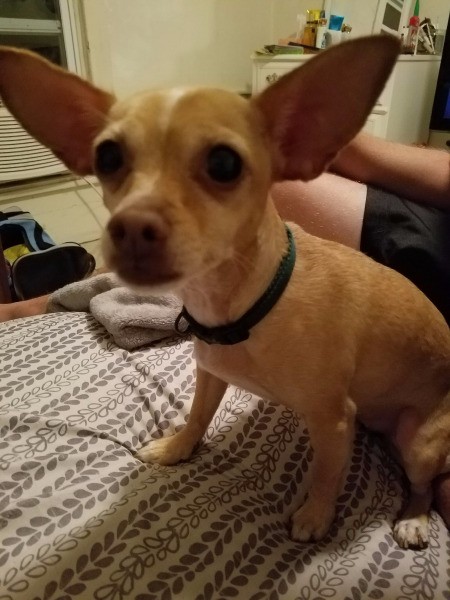
Identify the location of window. This screenshot has width=450, height=600. (53, 45).